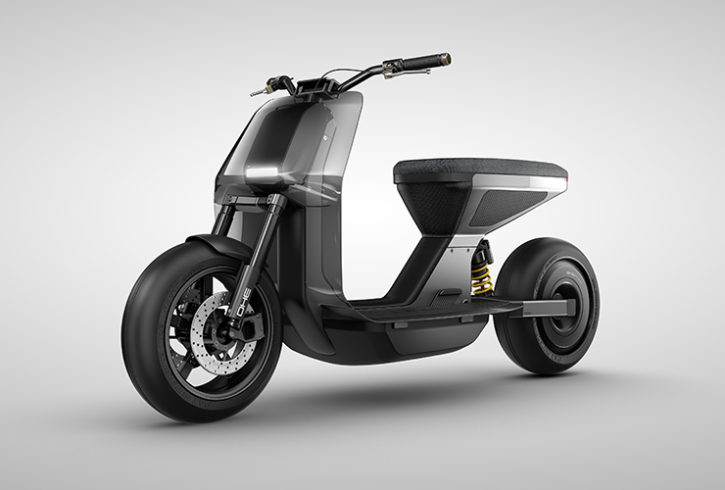
In order to click on scooter chair in this screenshot , I will do `click(473, 170)`.